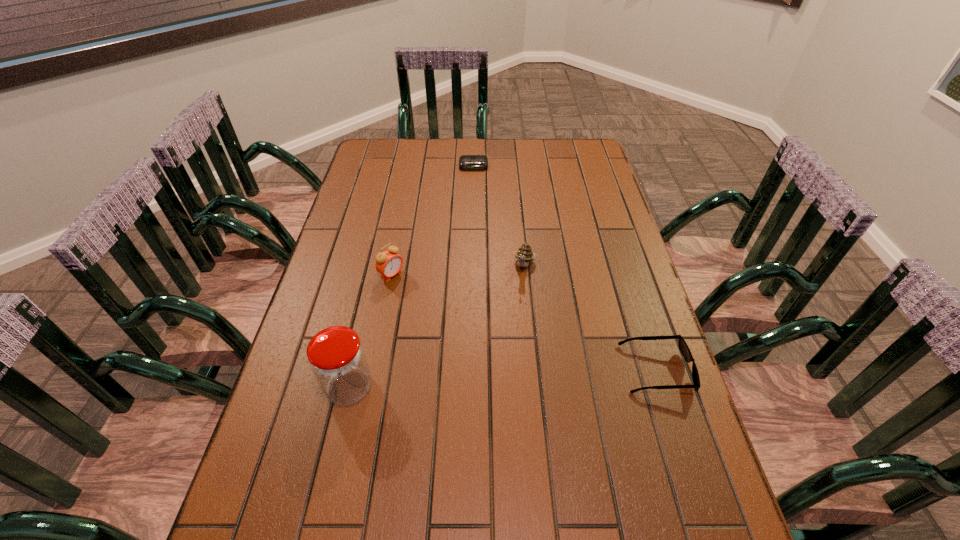
Find the location of a particular element. The height and width of the screenshot is (540, 960). object that is at the right edge is located at coordinates (683, 346).

Where is `vacant space at the far edge of the desktop`? This screenshot has width=960, height=540. vacant space at the far edge of the desktop is located at coordinates (557, 168).

This screenshot has width=960, height=540. In the image, there is a desktop. Identify the location of vacant space at the left edge. (366, 208).

This screenshot has height=540, width=960. Find the location of `vacant space at the right edge of the desktop`. vacant space at the right edge of the desktop is located at coordinates click(x=572, y=219).

Where is `vacant point at the far left corner`? vacant point at the far left corner is located at coordinates (393, 166).

Image resolution: width=960 pixels, height=540 pixels. I want to click on vacant space at the near left corner, so click(x=294, y=477).

Locate an element on the screen. This screenshot has height=540, width=960. free region at the far right corner is located at coordinates (565, 141).

Where is `vacant region between the left alarm clock and the fourth tallest object`? The width and height of the screenshot is (960, 540). vacant region between the left alarm clock and the fourth tallest object is located at coordinates (524, 322).

Find the location of `free point between the jar and the left alarm clock`. free point between the jar and the left alarm clock is located at coordinates (371, 331).

This screenshot has height=540, width=960. Find the location of `vacant point located between the taller alarm clock and the right alarm clock`. vacant point located between the taller alarm clock and the right alarm clock is located at coordinates (433, 220).